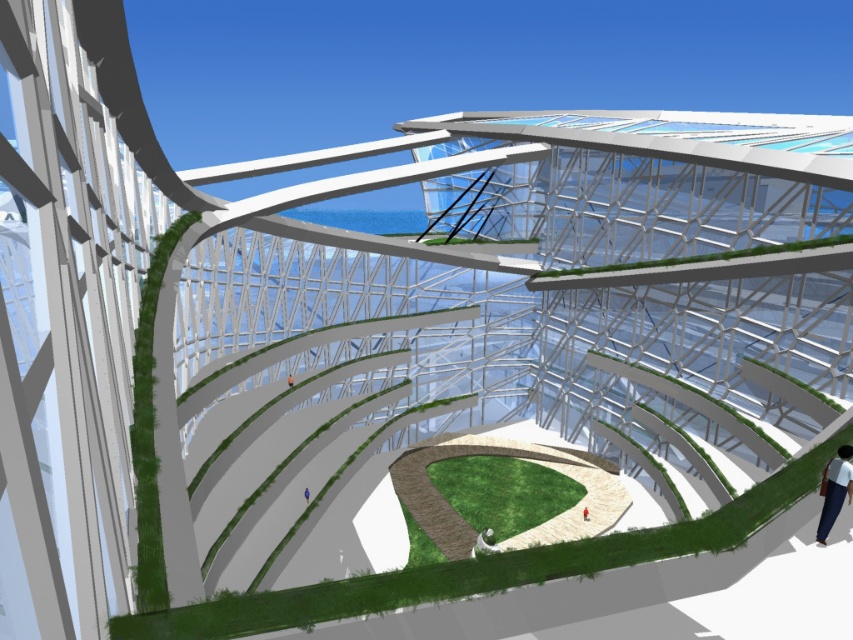
Between green grass at center and white fabric pants at lower right, which one has less height?

Standing shorter between the two is white fabric pants at lower right.

Who is positioned more to the right, green grass at center or white fabric pants at lower right?

Positioned to the right is white fabric pants at lower right.

Who is more distant from viewer, (450,470) or (821,484)?

The point (450,470) is more distant.

Where is `green grass at center`? Image resolution: width=853 pixels, height=640 pixels. green grass at center is located at coordinates (503, 492).